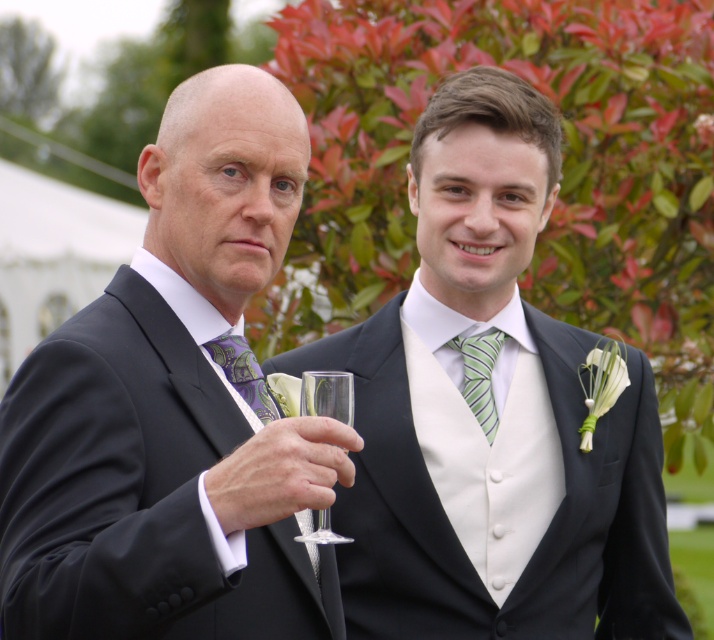
Question: Is matte black suit at right to the right of purple paisley tie at center from the viewer's perspective?

Choices:
 (A) yes
 (B) no

Answer: (A)

Question: Which point is closer to the camera taking this photo?

Choices:
 (A) (256, 406)
 (B) (482, 339)
 (C) (543, 547)
 (D) (351, 394)

Answer: (D)

Question: Which point is farther to the camera?

Choices:
 (A) (462, 289)
 (B) (246, 349)
 (C) (468, 339)
 (D) (328, 413)

Answer: (C)

Question: Which of the following is the farthest from the observer?

Choices:
 (A) (481, 381)
 (B) (183, 128)
 (C) (211, 340)

Answer: (A)

Question: Is matte black suit at left to the right of green striped tie at center from the viewer's perspective?

Choices:
 (A) no
 (B) yes

Answer: (A)

Question: Can you confirm if matte black suit at right is thinner than green striped tie at center?

Choices:
 (A) no
 (B) yes

Answer: (A)